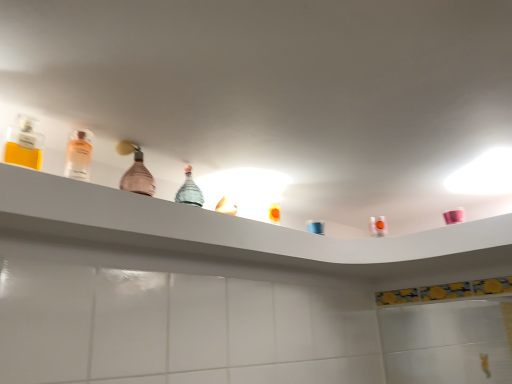
Question: In terms of height, does pink glass bottle at center, which appears as the 3th bottle when viewed from the left, look taller or shorter compared to matte glass bottles at upper center?

Choices:
 (A) short
 (B) tall

Answer: (B)

Question: Based on their positions, is pink glass bottle at center, arranged as the 1th bottle when viewed from the back, located to the left or right of matte glass bottles at upper center?

Choices:
 (A) left
 (B) right

Answer: (A)

Question: Estimate the real-world distances between objects in this image. Which object is farther from the translucent plastic mouthwash at upper right?

Choices:
 (A) clear glass perfume at upper left, which appears as the 1th bottle when viewed from the front
 (B) pink glass bottle at center, the 1th bottle from the right
 (C) matte glass bottles at upper center
 (D) clear glass bottle at left, the 2th bottle when ordered from front to back
 (E) blue plastic container at center

Answer: (A)

Question: Which is farther from the matte glass bottles at upper center?

Choices:
 (A) clear glass perfume at upper left, the 3th bottle positioned from the back
 (B) translucent plastic mouthwash at upper right
 (C) pink glass bottle at center, the 1th bottle from the right
 (D) blue plastic container at center
 (E) clear glass bottle at left, acting as the second bottle starting from the right

Answer: (B)